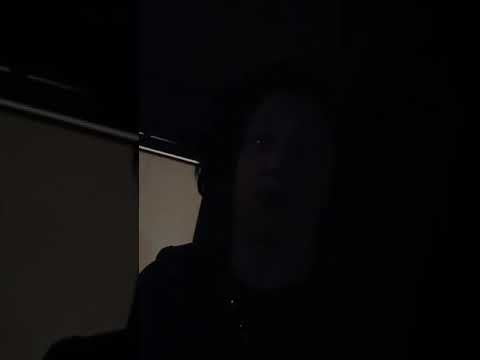
Where is `edge of wall`? edge of wall is located at coordinates (138, 217).